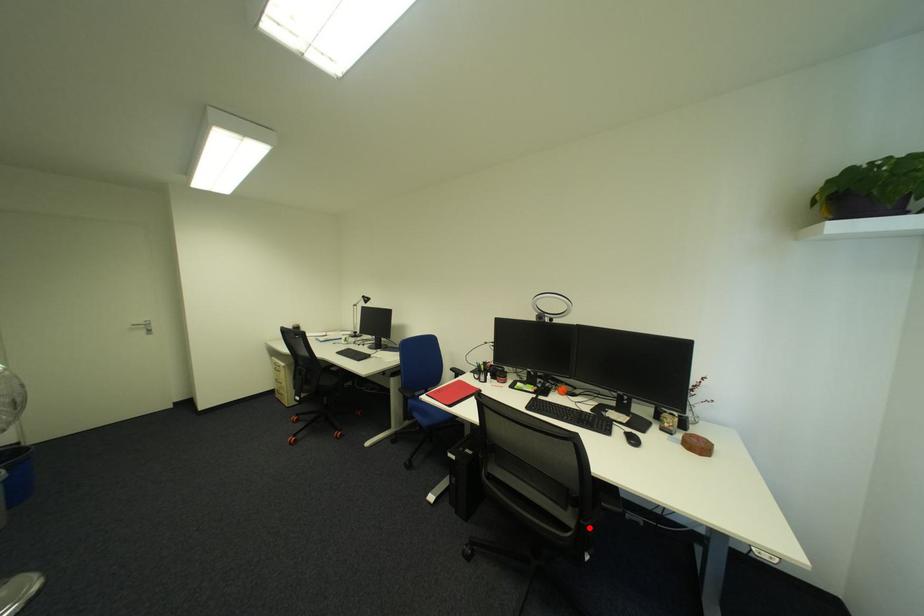
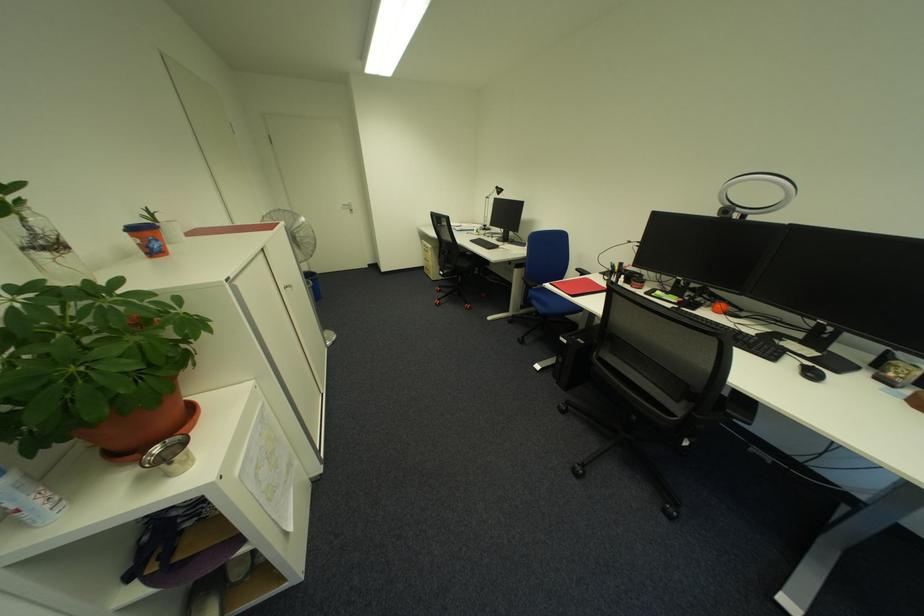
Find the pixel in the second image that matches the highlighted location in the first image.

(699, 419)